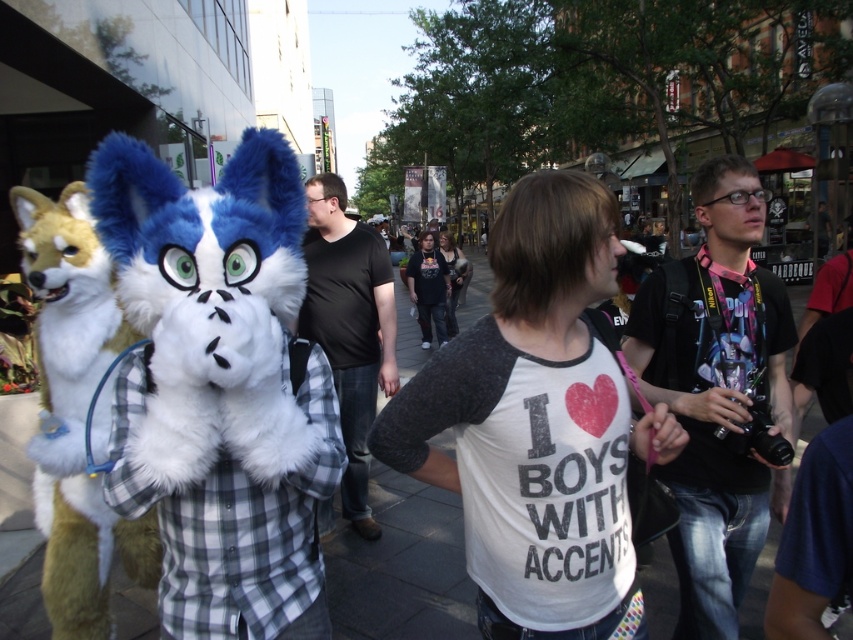
Question: Considering the real-world distances, which object is farthest from the fluffy white fox at left?

Choices:
 (A) dark gray hoodie at center
 (B) white raglan shirt at center
 (C) dark brown leather jacket at center

Answer: (C)

Question: Which object is farther from the camera taking this photo?

Choices:
 (A) white raglan shirt at center
 (B) black matte shirt at center
 (C) white fur costume at center

Answer: (B)

Question: Is fluffy white fox at left positioned in front of dark brown leather jacket at center?

Choices:
 (A) no
 (B) yes

Answer: (B)

Question: Considering the real-world distances, which object is closest to the white raglan shirt at center?

Choices:
 (A) black matte shirt at center
 (B) fluffy white fox at left
 (C) dark brown leather jacket at center

Answer: (A)

Question: Is white fur costume at center closer to the viewer compared to dark gray hoodie at center?

Choices:
 (A) yes
 (B) no

Answer: (A)

Question: Can you confirm if black fabric camera at right is positioned to the left of dark gray hoodie at center?

Choices:
 (A) yes
 (B) no

Answer: (B)